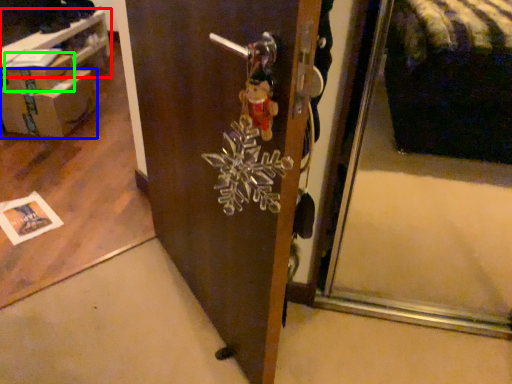
Question: Estimate the real-world distances between objects in this image. Which object is closer to table (highlighted by a red box), box (highlighted by a blue box) or cardboard box (highlighted by a green box)?

Choices:
 (A) box
 (B) cardboard box

Answer: (B)